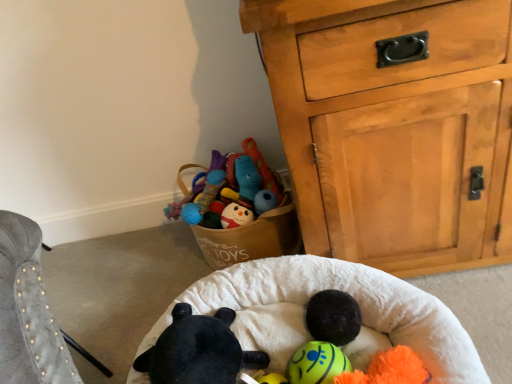
What are the coordinates of `light brown wooden chest of drawers at upper right` in the screenshot? It's located at (393, 128).

The width and height of the screenshot is (512, 384). In order to click on black plush toy at center, acting as the 1th toy starting from the left in this screenshot , I will do `click(198, 350)`.

Are black plush toy at center, which is the 2th toy in right-to-left order, and white soft infant bed at center far apart?

black plush toy at center, which is the 2th toy in right-to-left order, is near white soft infant bed at center, not far away.

Considering the positions of point (189, 381) and point (422, 310), is point (189, 381) closer or farther from the camera than point (422, 310)?

Point (189, 381) is closer to the camera than point (422, 310).

Is black plush toy at center, which is the 2th toy in right-to-left order, thinner than white soft infant bed at center?

Indeed, black plush toy at center, which is the 2th toy in right-to-left order, has a lesser width compared to white soft infant bed at center.

Is black plush toy at center, acting as the 1th toy starting from the left, not inside white soft infant bed at center?

That's incorrect, black plush toy at center, acting as the 1th toy starting from the left, is not completely outside white soft infant bed at center.

Who is more distant, light brown wooden chest of drawers at upper right or white soft infant bed at center?

light brown wooden chest of drawers at upper right.

From the image's perspective, between light brown wooden chest of drawers at upper right and white soft infant bed at center, who is located below?

white soft infant bed at center appears lower in the image.

Is point (405, 5) positioned before point (466, 342)?

Yes.

Between light brown wooden chest of drawers at upper right and neon yellow rubber ball at center, which is the 2th toy from left to right, which one has smaller size?

Smaller between the two is neon yellow rubber ball at center, which is the 2th toy from left to right.

From the image's perspective, does light brown wooden chest of drawers at upper right appear lower than neon yellow rubber ball at center, which is the 2th toy from left to right?

Actually, light brown wooden chest of drawers at upper right appears above neon yellow rubber ball at center, which is the 2th toy from left to right, in the image.

Which is closer, (362, 125) or (347, 358)?

Point (362, 125) is positioned closer to the camera compared to point (347, 358).

Is neon yellow rubber ball at center, acting as the first toy starting from the right, looking in the opposite direction of black plush toy at center, which is the 2th toy in right-to-left order?

Yes, black plush toy at center, which is the 2th toy in right-to-left order, is at the back of neon yellow rubber ball at center, acting as the first toy starting from the right.

From a real-world perspective, between neon yellow rubber ball at center, acting as the first toy starting from the right, and black plush toy at center, acting as the 1th toy starting from the left, who is vertically higher?

black plush toy at center, acting as the 1th toy starting from the left.

Which point is more forward, (x=296, y=361) or (x=251, y=354)?

The point (x=296, y=361) is in front.

Considering the relative sizes of neon yellow rubber ball at center, which is the 2th toy from left to right, and black plush toy at center, acting as the 1th toy starting from the left, in the image provided, is neon yellow rubber ball at center, which is the 2th toy from left to right, smaller than black plush toy at center, acting as the 1th toy starting from the left,?

Yes, neon yellow rubber ball at center, which is the 2th toy from left to right, is smaller than black plush toy at center, acting as the 1th toy starting from the left.

Is white soft infant bed at center beside light brown wooden chest of drawers at upper right?

white soft infant bed at center is not next to light brown wooden chest of drawers at upper right, and they're not touching.

From the picture: Which object is more forward, white soft infant bed at center or light brown wooden chest of drawers at upper right?

white soft infant bed at center is closer to the camera.

Considering the sizes of objects white soft infant bed at center and light brown wooden chest of drawers at upper right in the image provided, who is smaller, white soft infant bed at center or light brown wooden chest of drawers at upper right?

white soft infant bed at center.

From the image's perspective, is white soft infant bed at center on light brown wooden chest of drawers at upper right?

No, from the image's perspective, white soft infant bed at center is not over light brown wooden chest of drawers at upper right.

Is white soft infant bed at center taller than neon yellow rubber ball at center, which is the 2th toy from left to right?

Correct, white soft infant bed at center is much taller as neon yellow rubber ball at center, which is the 2th toy from left to right.

Between point (369, 295) and point (343, 361), which one is positioned behind?

Positioned behind is point (369, 295).

Based on their sizes in the image, would you say white soft infant bed at center is bigger or smaller than neon yellow rubber ball at center, acting as the first toy starting from the right?

Clearly, white soft infant bed at center is larger in size than neon yellow rubber ball at center, acting as the first toy starting from the right.

In the scene shown: From the image's perspective, is white soft infant bed at center located above or below neon yellow rubber ball at center, acting as the first toy starting from the right?

white soft infant bed at center is below neon yellow rubber ball at center, acting as the first toy starting from the right.

Is the depth of neon yellow rubber ball at center, which is the 2th toy from left to right, greater than that of light brown wooden chest of drawers at upper right?

Yes, the depth of neon yellow rubber ball at center, which is the 2th toy from left to right, is greater than that of light brown wooden chest of drawers at upper right.

From a real-world perspective, is neon yellow rubber ball at center, which is the 2th toy from left to right, physically below light brown wooden chest of drawers at upper right?

Indeed, from a real-world perspective, neon yellow rubber ball at center, which is the 2th toy from left to right, is positioned beneath light brown wooden chest of drawers at upper right.

Is light brown wooden chest of drawers at upper right surrounded by neon yellow rubber ball at center, acting as the first toy starting from the right?

No, light brown wooden chest of drawers at upper right is located outside of neon yellow rubber ball at center, acting as the first toy starting from the right.

From the image's perspective, would you say neon yellow rubber ball at center, which is the 2th toy from left to right, is shown under light brown wooden chest of drawers at upper right?

Yes.

Starting from the white soft infant bed at center, which toy is the 1st one behind? Please provide its 2D coordinates.

[(198, 350)]

You are a GUI agent. You are given a task and a screenshot of the screen. Output one action in this format:
    pyautogui.click(x=<x>, y=<y>)
    Task: Click on the infant bed in front of the light brown wooden chest of drawers at upper right
    
    Given the screenshot: What is the action you would take?
    pyautogui.click(x=338, y=289)

From the image, which object appears to be nearer to white soft infant bed at center, black plush toy at center, acting as the 1th toy starting from the left, or neon yellow rubber ball at center, acting as the first toy starting from the right?

The object closer to white soft infant bed at center is black plush toy at center, acting as the 1th toy starting from the left.

Consider the image. From the image, which object appears to be nearer to light brown wooden chest of drawers at upper right, black plush toy at center, acting as the 1th toy starting from the left, or white soft infant bed at center?

Among the two, white soft infant bed at center is located nearer to light brown wooden chest of drawers at upper right.

Considering their positions, is white soft infant bed at center positioned closer to black plush toy at center, acting as the 1th toy starting from the left, than neon yellow rubber ball at center, acting as the first toy starting from the right?

white soft infant bed at center lies closer to black plush toy at center, acting as the 1th toy starting from the left, than the other object.

In the scene shown: Which object lies further to the anchor point white soft infant bed at center, light brown wooden chest of drawers at upper right or neon yellow rubber ball at center, which is the 2th toy from left to right?

Based on the image, light brown wooden chest of drawers at upper right appears to be further to white soft infant bed at center.

Looking at the image, which one is located further to neon yellow rubber ball at center, acting as the first toy starting from the right, light brown wooden chest of drawers at upper right or white soft infant bed at center?

Among the two, light brown wooden chest of drawers at upper right is located further to neon yellow rubber ball at center, acting as the first toy starting from the right.

When comparing their distances from light brown wooden chest of drawers at upper right, does white soft infant bed at center or neon yellow rubber ball at center, acting as the first toy starting from the right, seem further?

neon yellow rubber ball at center, acting as the first toy starting from the right, is positioned further to the anchor light brown wooden chest of drawers at upper right.

Considering their positions, is white soft infant bed at center positioned closer to light brown wooden chest of drawers at upper right than black plush toy at center, which is the 2th toy in right-to-left order?

white soft infant bed at center.

Considering their positions, is light brown wooden chest of drawers at upper right positioned closer to neon yellow rubber ball at center, acting as the first toy starting from the right, than black plush toy at center, acting as the 1th toy starting from the left?

Based on the image, black plush toy at center, acting as the 1th toy starting from the left, appears to be nearer to neon yellow rubber ball at center, acting as the first toy starting from the right.

The image size is (512, 384). Identify the location of toy between light brown wooden chest of drawers at upper right and neon yellow rubber ball at center, which is the 2th toy from left to right, in the up-down direction. (198, 350).

Find the location of a particular element. The height and width of the screenshot is (384, 512). toy positioned between white soft infant bed at center and neon yellow rubber ball at center, which is the 2th toy from left to right, from near to far is located at coordinates (198, 350).